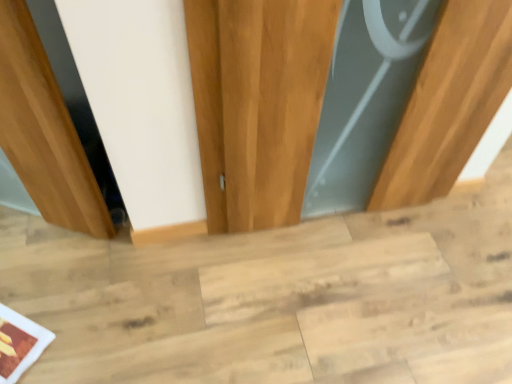
What do you see at coordinates (277, 298) in the screenshot? This screenshot has height=384, width=512. I see `light wood stair at center` at bounding box center [277, 298].

This screenshot has width=512, height=384. I want to click on light wood stair at center, so click(x=277, y=298).

What do you see at coordinates (257, 103) in the screenshot? I see `wooden door at center` at bounding box center [257, 103].

This screenshot has width=512, height=384. I want to click on wooden door at center, so click(x=257, y=103).

Measure the distance between point (x=412, y=199) and camera.

The depth of point (x=412, y=199) is 1.72 meters.

You are a GUI agent. You are given a task and a screenshot of the screen. Output one action in this format:
    pyautogui.click(x=<x>, y=<y>)
    Task: Click on the light wood stair at center
    The image size is (512, 384).
    Given the screenshot: What is the action you would take?
    pyautogui.click(x=277, y=298)

Which is more to the right, wooden door at center or light wood stair at center?

From the viewer's perspective, wooden door at center appears more on the right side.

Is the depth of wooden door at center less than that of light wood stair at center?

Yes, it is.

Which is closer to the camera, (504, 93) or (474, 314)?

Point (504, 93) is positioned closer to the camera compared to point (474, 314).

From the image's perspective, between wooden door at center and light wood stair at center, who is located below?

light wood stair at center, from the image's perspective.

Looking at this image, from a real-world perspective, is wooden door at center located beneath light wood stair at center?

Actually, wooden door at center is physically above light wood stair at center in the real world.

Is wooden door at center wider or thinner than light wood stair at center?

In the image, wooden door at center appears to be more narrow than light wood stair at center.

Does wooden door at center have a greater height compared to light wood stair at center?

Yes.

Between wooden door at center and light wood stair at center, which one has smaller size?

wooden door at center is smaller.

Does wooden door at center contain light wood stair at center?

No, light wood stair at center is located outside of wooden door at center.

Does wooden door at center touch light wood stair at center?

No, wooden door at center is not making contact with light wood stair at center.

Is wooden door at center facing towards light wood stair at center?

No, wooden door at center is not turned towards light wood stair at center.

Image resolution: width=512 pixels, height=384 pixels. I want to click on door on the right of light wood stair at center, so click(257, 103).

Considering the positions of objects light wood stair at center and wooden door at center in the image provided, who is more to the left, light wood stair at center or wooden door at center?

Positioned to the left is light wood stair at center.

Is the depth of light wood stair at center greater than that of wooden door at center?

Yes, it is.

Does point (233, 345) come closer to viewer compared to point (507, 22)?

No.

From the image's perspective, is light wood stair at center on wooden door at center?

No.

From a real-world perspective, who is located higher, light wood stair at center or wooden door at center?

wooden door at center is physically above.

Is light wood stair at center wider or thinner than wooden door at center?

Considering their sizes, light wood stair at center looks broader than wooden door at center.

From the picture: Considering the relative sizes of light wood stair at center and wooden door at center in the image provided, is light wood stair at center taller than wooden door at center?

No, light wood stair at center is not taller than wooden door at center.

Between light wood stair at center and wooden door at center, which one has larger size?

light wood stair at center is bigger.

Is light wood stair at center inside or outside of wooden door at center?

Result: light wood stair at center is located beyond the bounds of wooden door at center.

Are light wood stair at center and wooden door at center far apart?

light wood stair at center is near wooden door at center, not far away.

Does light wood stair at center turn towards wooden door at center?

No, light wood stair at center is not facing towards wooden door at center.

How many degrees apart are the facing directions of light wood stair at center and wooden door at center?

The angle between the facing direction of light wood stair at center and the facing direction of wooden door at center is 88.4 degrees.

How far apart are light wood stair at center and wooden door at center?

They are 19.84 inches apart.

In the image, there is a wooden door at center. Where is `stair below it (from the image's perspective)`? The width and height of the screenshot is (512, 384). stair below it (from the image's perspective) is located at coordinates coord(277,298).

Find the location of a particular element. This screenshot has height=384, width=512. door that is on the right side of light wood stair at center is located at coordinates (257, 103).

This screenshot has width=512, height=384. Find the location of `stair lying below the wooden door at center (from the image's perspective)`. stair lying below the wooden door at center (from the image's perspective) is located at coordinates (277, 298).